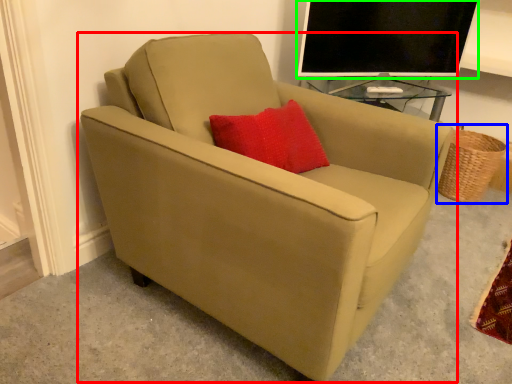
Question: Based on their relative distances, which object is nearer to chair (highlighted by a red box)? Choose from basket (highlighted by a blue box) and television (highlighted by a green box).

Choices:
 (A) basket
 (B) television

Answer: (B)